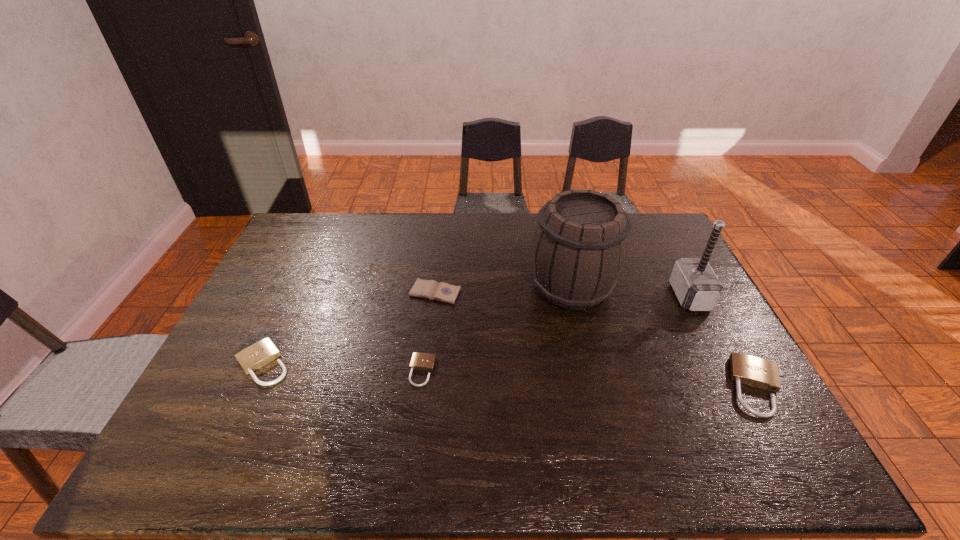
If equal spacing is the goal by inserting an additional padlock among them, please point out a vacant space for this new padlock. Please provide its 2D coordinates. Your answer should be formatted as a tuple, i.e. [(x, y)], where the tuple contains the x and y coordinates of a point satisfying the conditions above.

[(587, 379)]